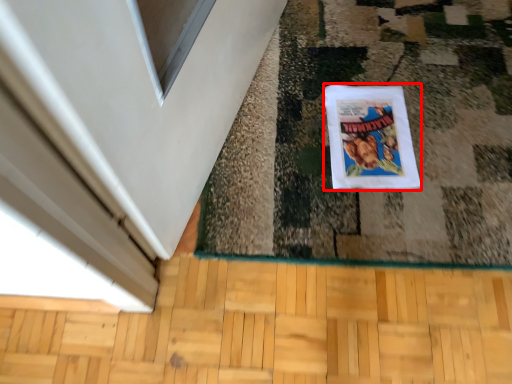
Question: From the image's perspective, where is comic book (annotated by the red box) located relative to hardwood?

Choices:
 (A) below
 (B) above

Answer: (B)